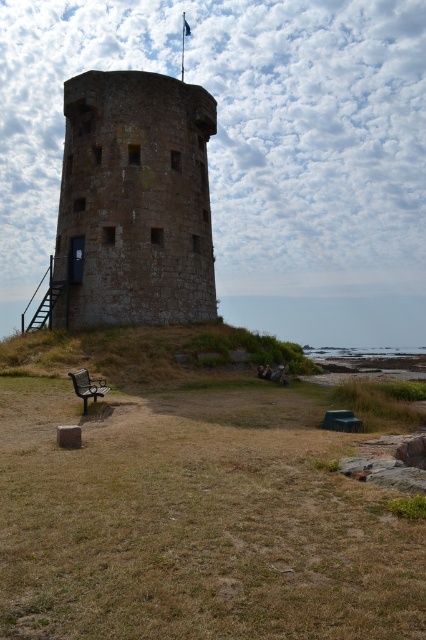
Looking at this image, you are standing at the camera position and want to take a photo of the brown stone tower at center. If your camera has a maximum zoom range of 25 meters, will you be able to capture the entire tower in the photo without moving closer?

The brown stone tower at center and camera are 26.62 meters apart, which exceeds the camera maximum zoom range of 25 meters. Therefore, you cannot capture the entire tower in the photo without moving closer.

You are standing at the entrance of the brown stone tower at center. If you face directly towards the point with coordinates 0.314, 0.317, which direction should you look?

The point [135,200] is the location of the brown stone tower at center, so facing directly towards it would mean looking straight ahead since you are already at the entrance of the tower.

You are planning to take a photo of the brown stone tower at center and the wooden bench at lower left from a position where both are visible. Considering their heights, which object will appear taller in the photo?

The brown stone tower at center will appear taller in the photo because it has a greater height compared to the wooden bench at lower left.